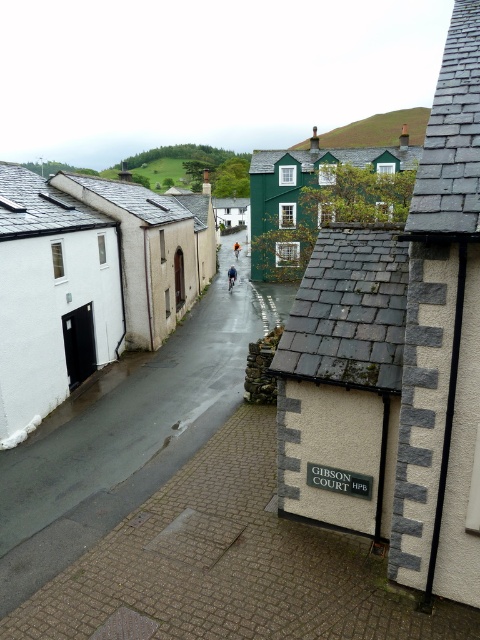
Which is in front, point (81, 472) or point (238, 248)?

Point (81, 472) is more forward.

Is point (84, 532) closer to camera compared to point (235, 250)?

That is True.

I want to click on smooth asphalt road at center, so click(x=128, y=435).

Who is higher up, blue fabric jacket at center or orange fabric jacket at center?

Positioned higher is orange fabric jacket at center.

What are the coordinates of `blue fabric jacket at center` in the screenshot? It's located at (231, 276).

In the scene shown: Who is more distant from viewer, (52, 451) or (230, 289)?

The point (230, 289) is behind.

Does smooth asphalt road at center have a greater height compared to blue fabric jacket at center?

Yes.

The width and height of the screenshot is (480, 640). Describe the element at coordinates (128, 435) in the screenshot. I see `smooth asphalt road at center` at that location.

Image resolution: width=480 pixels, height=640 pixels. What are the coordinates of `smooth asphalt road at center` in the screenshot? It's located at (128, 435).